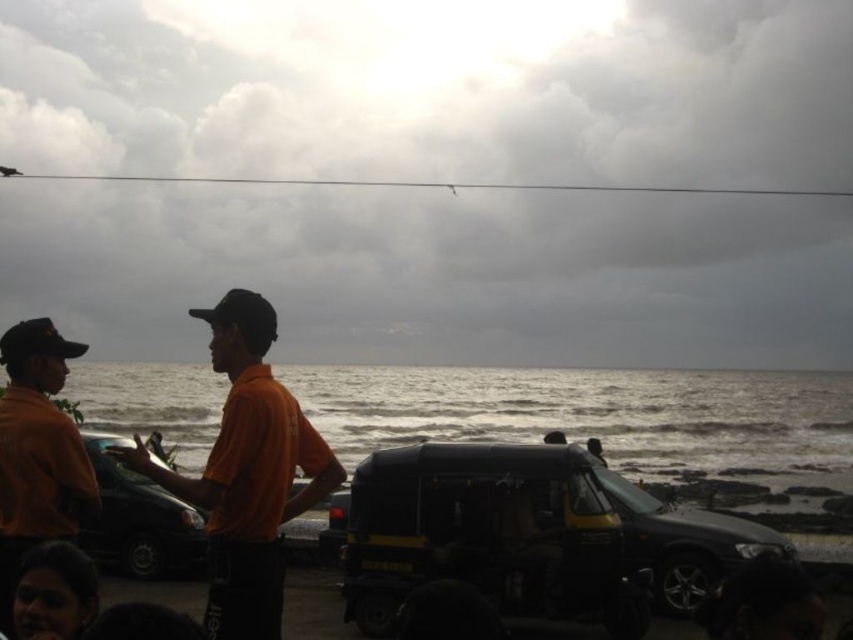
Question: Which point is closer to the camera?

Choices:
 (A) (137, 484)
 (B) (253, 456)
 (C) (67, 499)

Answer: (B)

Question: Which of the following is the farthest from the observer?

Choices:
 (A) (283, 426)
 (B) (524, 570)
 (C) (126, 500)

Answer: (C)

Question: Does black matte jeep at center come behind orange matte shirt at lower left?

Choices:
 (A) yes
 (B) no

Answer: (A)

Question: Is black matte jeep at center closer to camera compared to shiny black car at left?

Choices:
 (A) yes
 (B) no

Answer: (B)

Question: Which point is farther to the camera?

Choices:
 (A) orange matte shirt at lower left
 (B) shiny black car at left

Answer: (B)

Question: Is black matte jeep at center thinner than orange matte shirt at lower left?

Choices:
 (A) yes
 (B) no

Answer: (A)